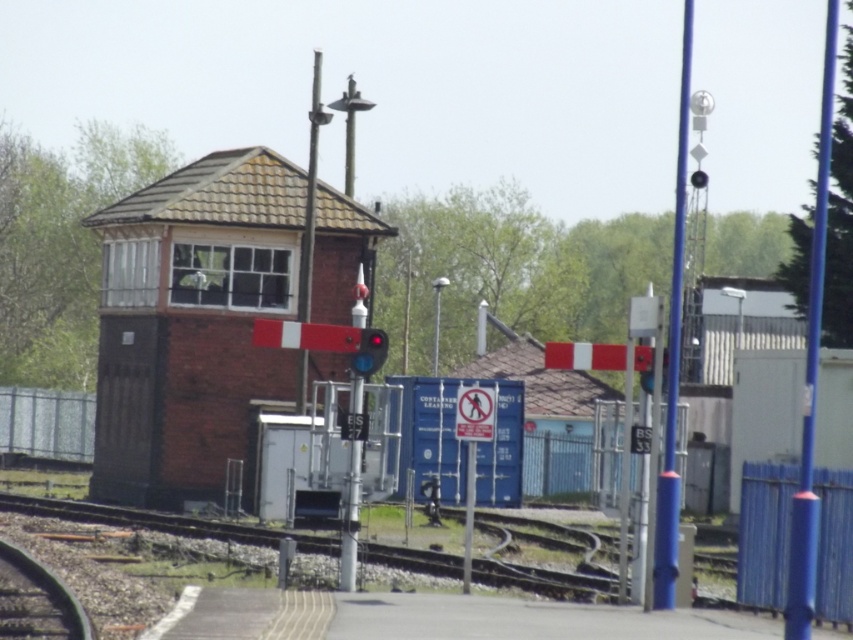
Does brick textured railway signal at center have a greater height compared to red glass traffic light at center?

Correct, brick textured railway signal at center is much taller as red glass traffic light at center.

Is point (283, 164) positioned in front of point (369, 369)?

That is False.

Does point (283, 218) come in front of point (381, 356)?

No.

What are the coordinates of `brick textured railway signal at center` in the screenshot? It's located at (x=193, y=324).

Is brick textured railway signal at center bigger than smooth metal rail at lower left?

Yes, brick textured railway signal at center is bigger than smooth metal rail at lower left.

Is brick textured railway signal at center shorter than smooth metal rail at lower left?

No, brick textured railway signal at center is not shorter than smooth metal rail at lower left.

Between point (125, 236) and point (78, 632), which one is positioned behind?

Positioned behind is point (125, 236).

You are a GUI agent. You are given a task and a screenshot of the screen. Output one action in this format:
    pyautogui.click(x=<x>, y=<y>)
    Task: Click on the brick textured railway signal at center
    This screenshot has height=640, width=853.
    Given the screenshot: What is the action you would take?
    pyautogui.click(x=193, y=324)

Is point (56, 620) less distant than point (376, 339)?

That is True.

Does smooth metal rail at lower left have a lesser height compared to red glass traffic light at center?

Correct, smooth metal rail at lower left is not as tall as red glass traffic light at center.

What do you see at coordinates (36, 600) in the screenshot?
I see `smooth metal rail at lower left` at bounding box center [36, 600].

Find the location of a particular element. This screenshot has width=853, height=640. smooth metal rail at lower left is located at coordinates (36, 600).